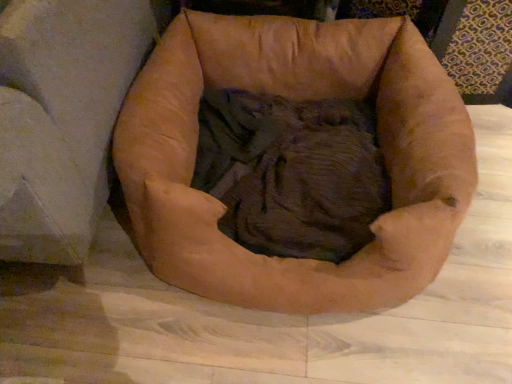
Question: Should I look upward or downward to see brown leather swivel chair at center?

Choices:
 (A) up
 (B) down

Answer: (A)